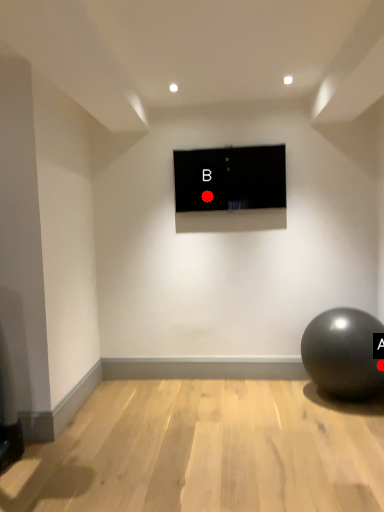
Question: Two points are circled on the image, labeled by A and B beside each circle. Which point is farther to the camera?

Choices:
 (A) A is further
 (B) B is further

Answer: (B)